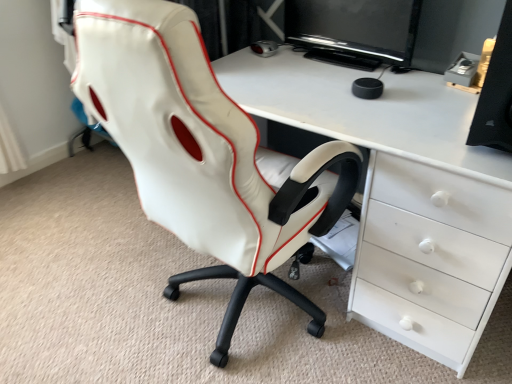
You are a GUI agent. You are given a task and a screenshot of the screen. Output one action in this format:
    pyautogui.click(x=<x>, y=<y>)
    Task: Click on the vacant area in front of black glossy monitor at upper center
    
    Given the screenshot: What is the action you would take?
    pyautogui.click(x=352, y=89)